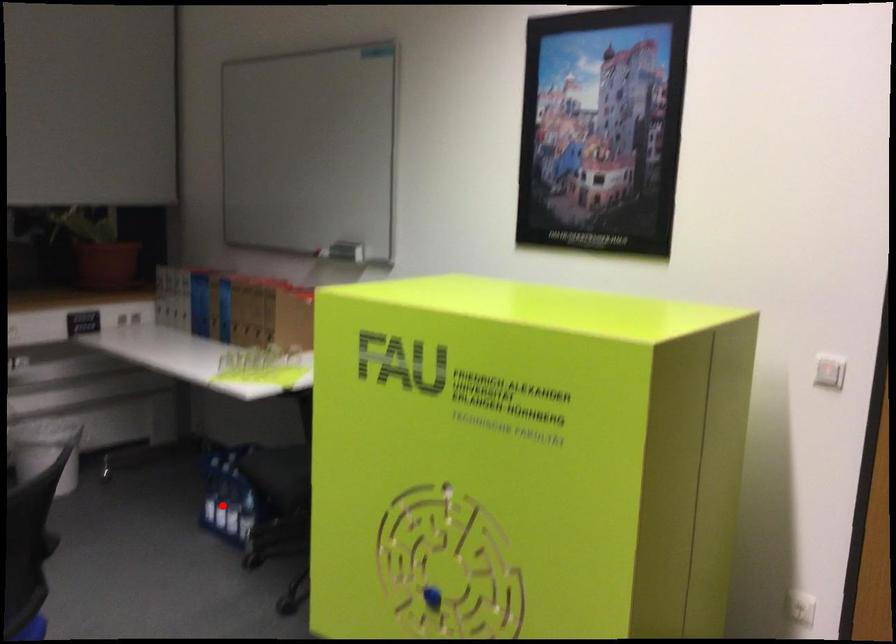
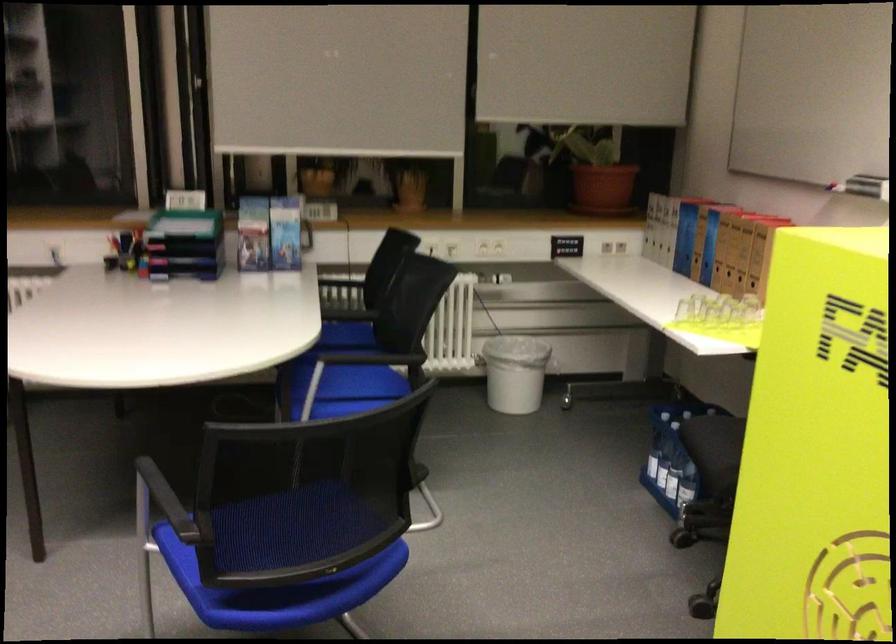
Question: I am providing you with two images of the same scene from different viewpoints. A red point is shown in image1. For the corresponding object point in image2, is it positioned nearer or farther from the camera?

Choices:
 (A) Nearer
 (B) Farther

Answer: (A)